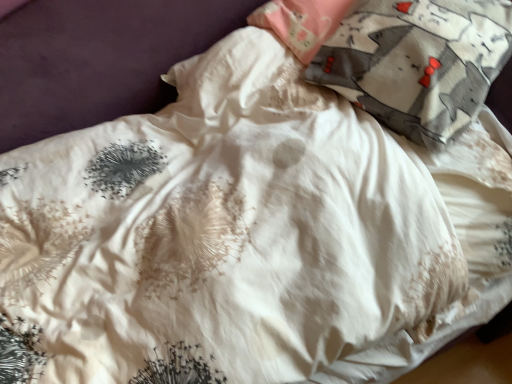
Where is `fluffy cotton pillow at upper right`? fluffy cotton pillow at upper right is located at coordinates (418, 63).

The height and width of the screenshot is (384, 512). Describe the element at coordinates (418, 63) in the screenshot. I see `fluffy cotton pillow at upper right` at that location.

From the picture: What is the approximate height of fluffy cotton pillow at upper right?

fluffy cotton pillow at upper right is 19.30 inches tall.

Where is `fluffy cotton pillow at upper right`? The height and width of the screenshot is (384, 512). fluffy cotton pillow at upper right is located at coordinates (418, 63).